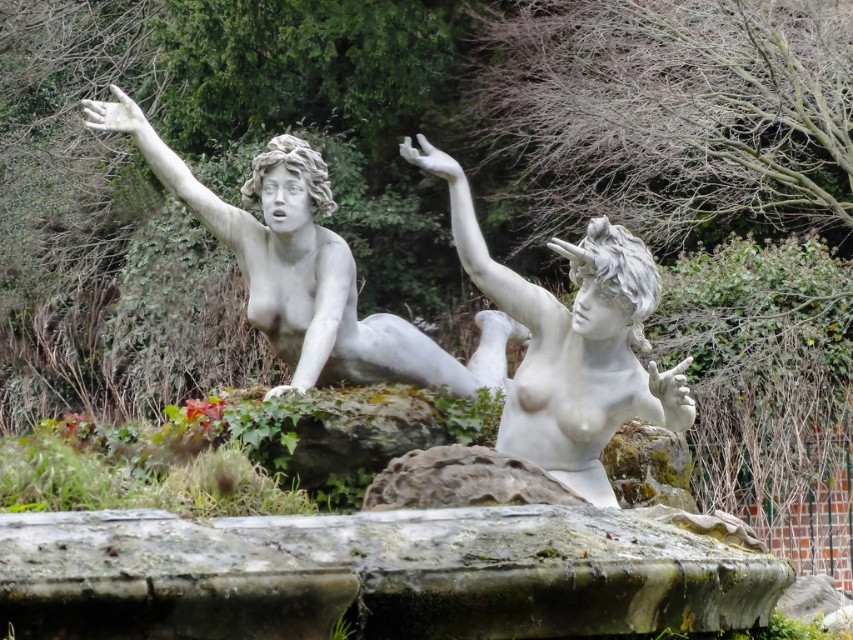
Does white marble mermaid at upper left have a lesser height compared to white marble statue at center?

Indeed, white marble mermaid at upper left has a lesser height compared to white marble statue at center.

Does point (314, 173) come in front of point (651, 400)?

No, it is not.

Where is `white marble mermaid at upper left`? white marble mermaid at upper left is located at coordinates (309, 272).